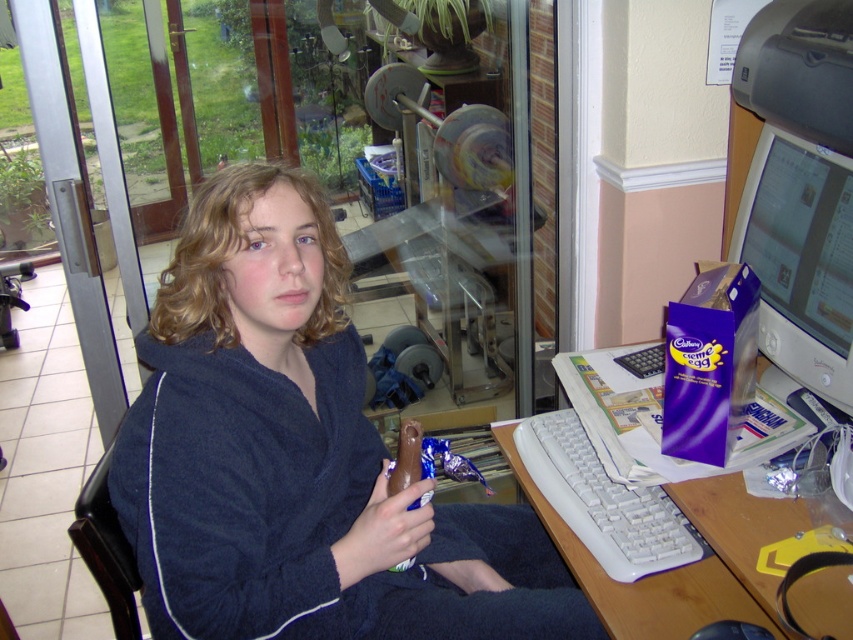
This screenshot has width=853, height=640. What are the coordinates of `dark blue plush robe at center` in the screenshot? It's located at pos(299,456).

Does dark blue plush robe at center have a lesser height compared to matte plastic computer monitor at right?

Incorrect, dark blue plush robe at center's height does not fall short of matte plastic computer monitor at right's.

Does point (289, 368) lie behind point (833, 234)?

No, (289, 368) is in front of (833, 234).

Locate an element on the screen. The width and height of the screenshot is (853, 640). dark blue plush robe at center is located at coordinates (299, 456).

Which of these two, white plastic keyboard at right or white plastic keyboard at lower center, stands shorter?

With less height is white plastic keyboard at lower center.

Which is below, white plastic keyboard at right or white plastic keyboard at lower center?

Positioned lower is white plastic keyboard at right.

Which is in front, point (695, 589) or point (648, 554)?

Point (695, 589) is in front.

Locate an element on the screen. white plastic keyboard at right is located at coordinates (691, 564).

Is transparent glass door at upper center positioned in front of white plastic keyboard at lower center?

No, it is not.

Is point (149, 214) less distant than point (608, 520)?

No, it is behind (608, 520).

At what (x,y) coordinates should I click in order to perform the action: click on transparent glass door at upper center. Please return your answer as a coordinate pair (x, y). The width and height of the screenshot is (853, 640). Looking at the image, I should click on (469, 237).